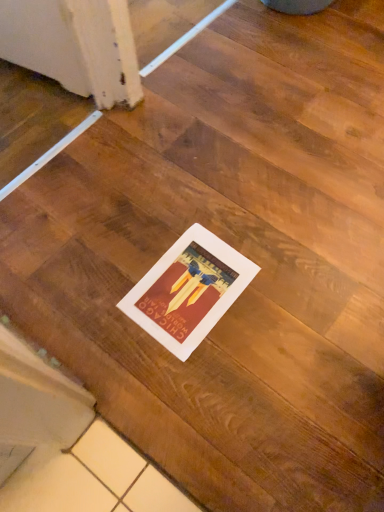
The height and width of the screenshot is (512, 384). Find the location of `vacant space in front of matte paper poster at center`. vacant space in front of matte paper poster at center is located at coordinates click(x=199, y=389).